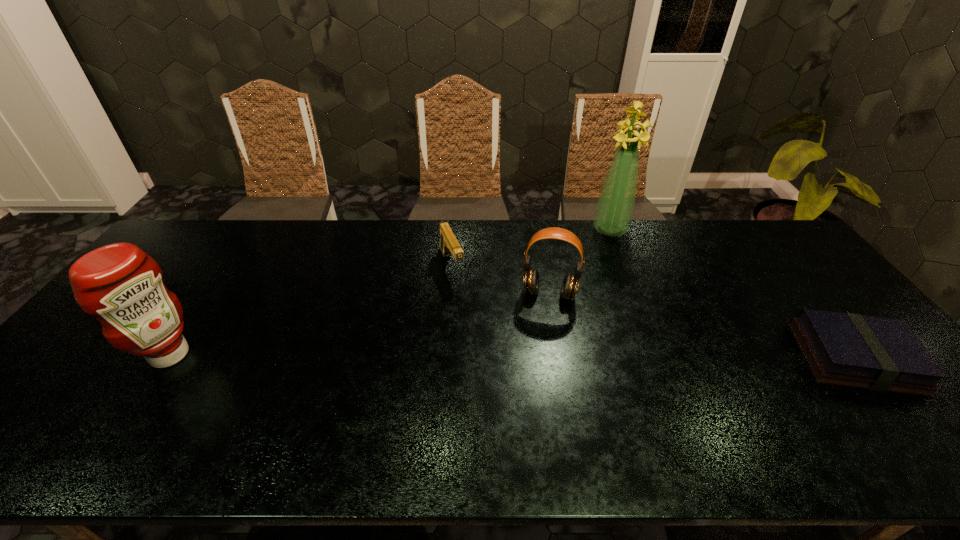
This screenshot has width=960, height=540. In the image, there is a desktop. Find the location of `free region at the far right corner`. free region at the far right corner is located at coordinates (756, 221).

In the image, there is a desktop. Where is `vacant space at the near right corner`? The width and height of the screenshot is (960, 540). vacant space at the near right corner is located at coordinates (900, 394).

Locate an element on the screen. This screenshot has height=540, width=960. vacant space in between the second object from right to left and the condiment is located at coordinates (390, 293).

Where is `unoccupied area between the shortest object and the third object from left to right`? unoccupied area between the shortest object and the third object from left to right is located at coordinates (702, 326).

Where is `free space between the tallest object and the headset`? The height and width of the screenshot is (540, 960). free space between the tallest object and the headset is located at coordinates (580, 262).

Find the location of a particular element. Image resolution: width=960 pixels, height=540 pixels. unoccupied position between the tallest object and the third object from right to left is located at coordinates (580, 262).

The image size is (960, 540). I want to click on free point between the leftmost object and the fourth object from right to left, so click(x=310, y=310).

This screenshot has width=960, height=540. In order to click on blank region between the third shortest object and the fourth object from left to right in this screenshot , I will do `click(580, 262)`.

Locate an element on the screen. The height and width of the screenshot is (540, 960). vacant point located between the fourth tallest object and the headset is located at coordinates (500, 279).

Locate an element on the screen. free space that is in between the headset and the shortest object is located at coordinates (702, 326).